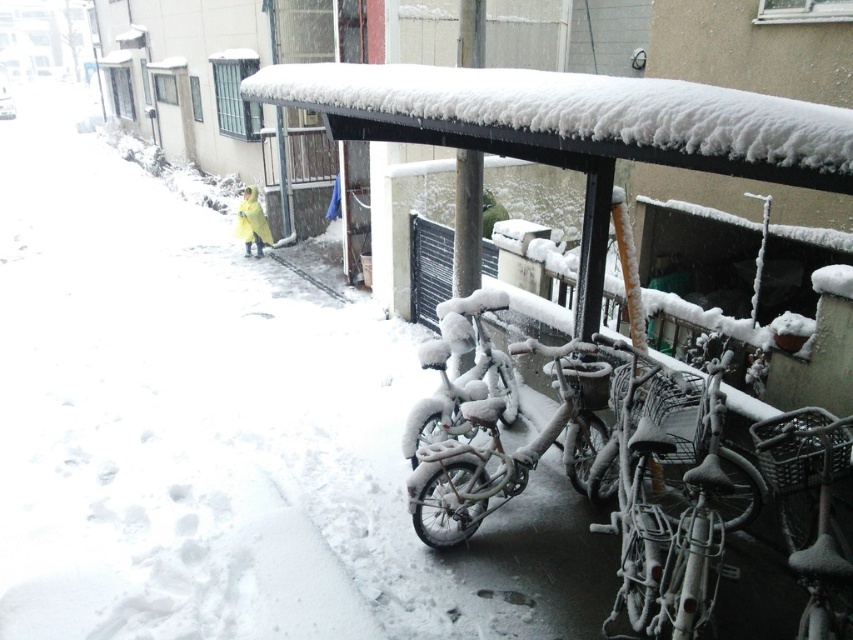
Question: Which point is closer to the camera taking this photo?

Choices:
 (A) (x=457, y=492)
 (B) (x=706, y=484)

Answer: (B)

Question: Where is white matte bicycle at lower right located in relation to snow-covered metal bicycle at center in the image?

Choices:
 (A) above
 (B) below

Answer: (B)

Question: Is white matte bicycle at lower right smaller than snow-covered metal bicycle at center?

Choices:
 (A) yes
 (B) no

Answer: (B)

Question: From the image, what is the correct spatial relationship of white matte bicycle at lower right in relation to snow-covered metal bicycle at center?

Choices:
 (A) below
 (B) above

Answer: (A)

Question: Which point is closer to the camera?

Choices:
 (A) frosted metallic bicycle at center
 (B) metallic silver bicycle at lower right
 (C) white matte bicycle at lower right
 (D) snow-covered metal bicycle at center

Answer: (B)

Question: Which point is closer to the camera?

Choices:
 (A) (846, 440)
 (B) (640, 570)
 (C) (554, 374)
 (D) (454, 390)

Answer: (B)